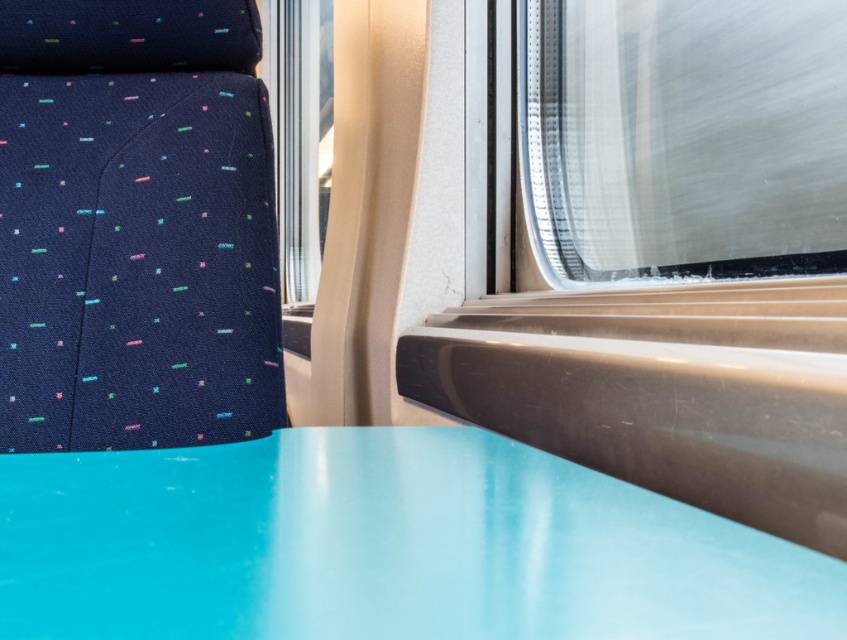
Question: In this image, where is glossy plastic table at center located relative to transparent glass train window at upper right?

Choices:
 (A) right
 (B) left

Answer: (B)

Question: Is glossy plastic table at center to the right of transparent glass train window at upper right from the viewer's perspective?

Choices:
 (A) yes
 (B) no

Answer: (B)

Question: Does glossy plastic table at center have a larger size compared to transparent glass train window at upper right?

Choices:
 (A) yes
 (B) no

Answer: (B)

Question: Which point is farther from the camera taking this photo?

Choices:
 (A) (754, 218)
 (B) (756, 582)

Answer: (A)

Question: Which of the following is the farthest from the observer?

Choices:
 (A) glossy plastic table at center
 (B) transparent glass train window at upper right

Answer: (B)